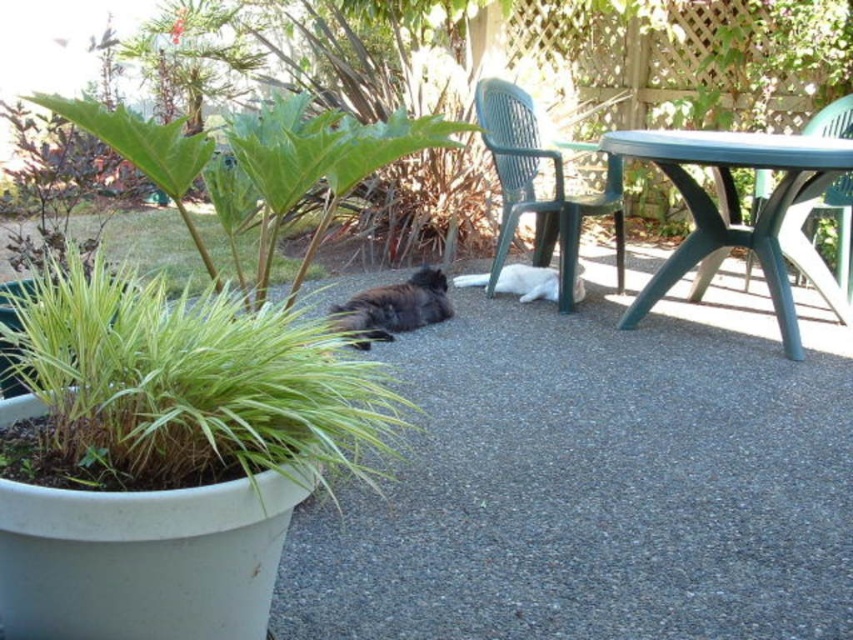
Question: Can you confirm if green plastic chair at center is smaller than green leafy grass at center?

Choices:
 (A) yes
 (B) no

Answer: (A)

Question: Is green plastic chair at center closer to the viewer compared to green leafy grass at center?

Choices:
 (A) no
 (B) yes

Answer: (B)

Question: Which point is closer to the camera taking this photo?

Choices:
 (A) (761, 170)
 (B) (782, 209)
 (C) (605, 179)
 (D) (280, 100)

Answer: (B)

Question: Does green leafy plant at center appear on the left side of green leafy grass at center?

Choices:
 (A) yes
 (B) no

Answer: (B)

Question: Considering the real-world distances, which object is closest to the green plastic table at upper right?

Choices:
 (A) green leafy plant at left
 (B) white fur cat at center
 (C) green plastic chair at upper right

Answer: (C)

Question: Which of these objects is positioned farthest from the green plastic table at upper right?

Choices:
 (A) white fur cat at center
 (B) dark gray fur at center
 (C) green leafy plant at center
 (D) green leafy plant at left

Answer: (D)